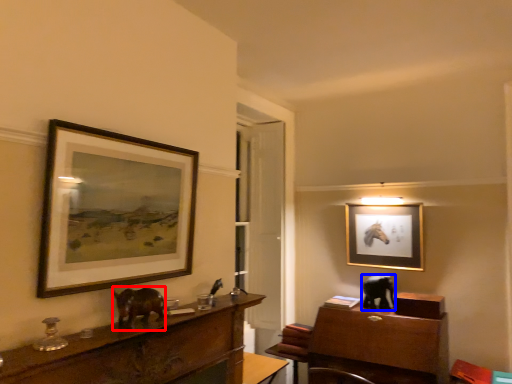
Question: Which object appears farthest to the camera in this image, animal (highlighted by a red box) or animal (highlighted by a blue box)?

Choices:
 (A) animal
 (B) animal

Answer: (B)